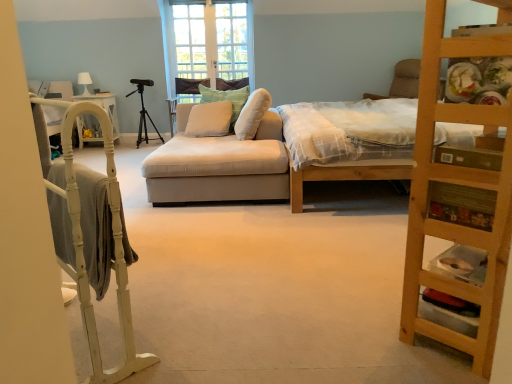
Question: From a real-world perspective, is white painted wood bunk bed at left physically located above or below green textured pillow at center, placed as the third pillow when sorted from left to right?

Choices:
 (A) below
 (B) above

Answer: (A)

Question: Considering the relative positions of white painted wood bunk bed at left and green textured pillow at center, placed as the first pillow when sorted from right to left, in the image provided, is white painted wood bunk bed at left to the left or to the right of green textured pillow at center, placed as the first pillow when sorted from right to left,?

Choices:
 (A) left
 (B) right

Answer: (A)

Question: Which object is positioned farthest from the white fabric cat bed at left?

Choices:
 (A) green textured pillow at center, placed as the third pillow when sorted from left to right
 (B) white soft cushion at center, arranged as the third pillow when viewed from the right
 (C) soft green pillow at center, which appears as the 2th pillow when viewed from the right
 (D) wooden ladder at right
 (E) white painted wood bunk bed at left

Answer: (D)

Question: Estimate the real-world distances between objects in this image. Which object is farther from the soft green pillow at center, which appears as the 2th pillow when viewed from the right?

Choices:
 (A) wooden ladder at right
 (B) green textured pillow at center, placed as the third pillow when sorted from left to right
 (C) white soft cushion at center, the first pillow viewed from the left
 (D) black matte tripod at center
 (E) white fabric cat bed at left

Answer: (A)